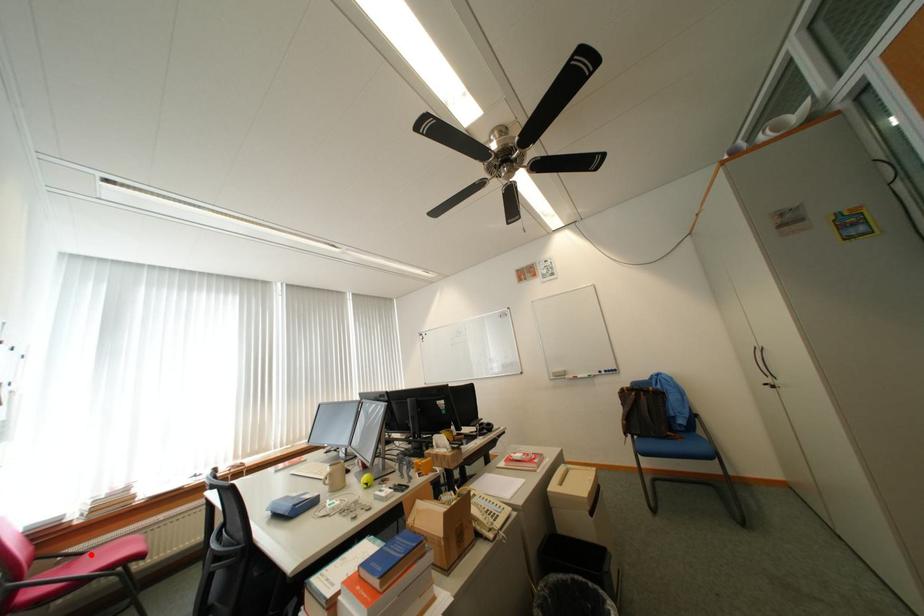
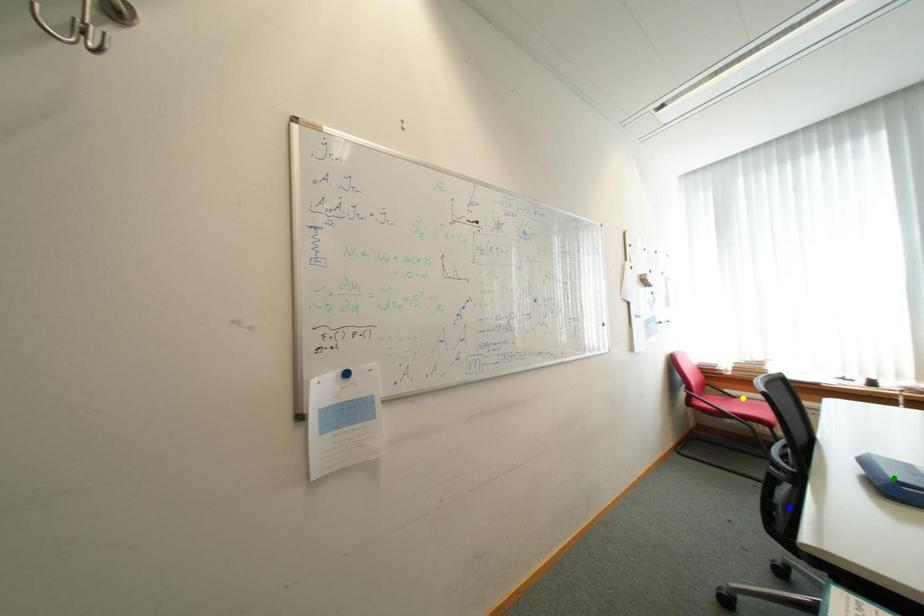
Question: I am providing you with two images of the same scene from different viewpoints. A red point is marked on the first image. You are given multiple points on the second image. Which spot in image 2 lines up with the point in image 1?

Choices:
 (A) yellow point
 (B) blue point
 (C) green point

Answer: (A)